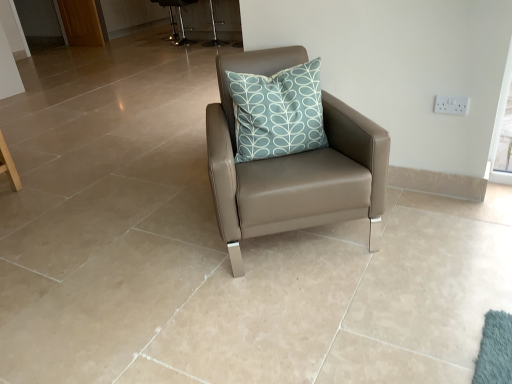
Question: From a real-world perspective, relative to white plastic electric outlet at upper right, is teal printed cushion at center vertically above or below?

Choices:
 (A) below
 (B) above

Answer: (B)

Question: Is teal printed cushion at center spatially inside white plastic electric outlet at upper right, or outside of it?

Choices:
 (A) inside
 (B) outside

Answer: (B)

Question: Which is nearer to the brown wooden screen door at upper left?

Choices:
 (A) teal printed cushion at center
 (B) transparent glass window screen at upper right
 (C) matte leather chair at center
 (D) metallic silver bar stool at upper center, the 2th bar stool from the back
 (E) metallic silver bar stool at upper center, the first bar stool when ordered from left to right

Answer: (E)

Question: Based on their relative distances, which object is nearer to the metallic silver bar stool at upper center, the second bar stool in the right-to-left sequence?

Choices:
 (A) metallic silver bar stool at upper center, arranged as the second bar stool when viewed from the left
 (B) teal printed cushion at center
 (C) transparent glass window screen at upper right
 (D) brown wooden screen door at upper left
 (E) matte leather chair at center

Answer: (A)